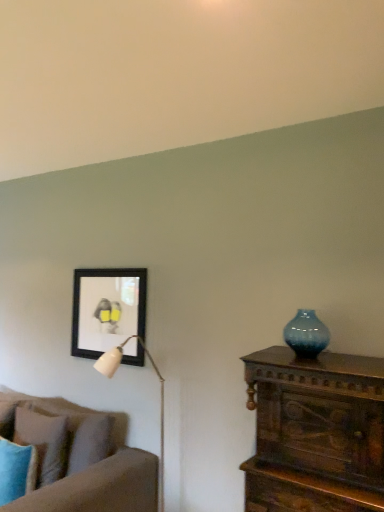
Question: Is black matte picture frame at upper left spatially inside blue glass vase at right, or outside of it?

Choices:
 (A) outside
 (B) inside

Answer: (A)

Question: Looking at their shapes, would you say black matte picture frame at upper left is wider or thinner than blue glass vase at right?

Choices:
 (A) thin
 (B) wide

Answer: (A)

Question: Estimate the real-world distances between objects in this image. Which object is closer to the matte blue pillow at lower left, which is the 1th pillow from front to back?

Choices:
 (A) black matte picture frame at upper left
 (B) white glossy table lamp at upper left
 (C) soft brown fabric couch at left
 (D) textured brown pillow at lower left, marked as the first pillow in a back-to-front arrangement
 (E) blue glass vase at right

Answer: (D)

Question: Which is nearer to the soft brown fabric couch at left?

Choices:
 (A) black matte picture frame at upper left
 (B) white glossy table lamp at upper left
 (C) matte blue pillow at lower left, which is the 1th pillow from front to back
 (D) blue glass vase at right
 (E) textured brown pillow at lower left, which appears as the second pillow when viewed from the front

Answer: (E)